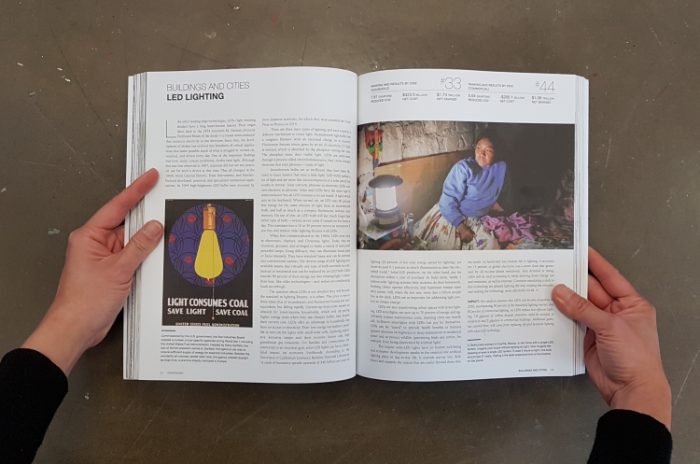
You are a GUI agent. You are given a task and a screenshot of the screen. Output one action in this format:
    pyautogui.click(x=<x>, y=<y>)
    Task: Click on the book
    
    Given the screenshot: What is the action you would take?
    pyautogui.click(x=288, y=95)